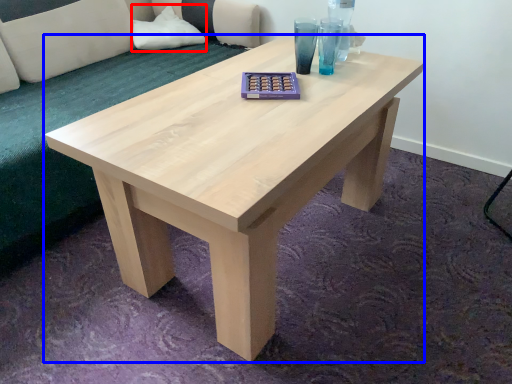
Question: Which of the following is the closest to the observer, pillow (highlighted by a red box) or coffee table (highlighted by a blue box)?

Choices:
 (A) pillow
 (B) coffee table

Answer: (B)